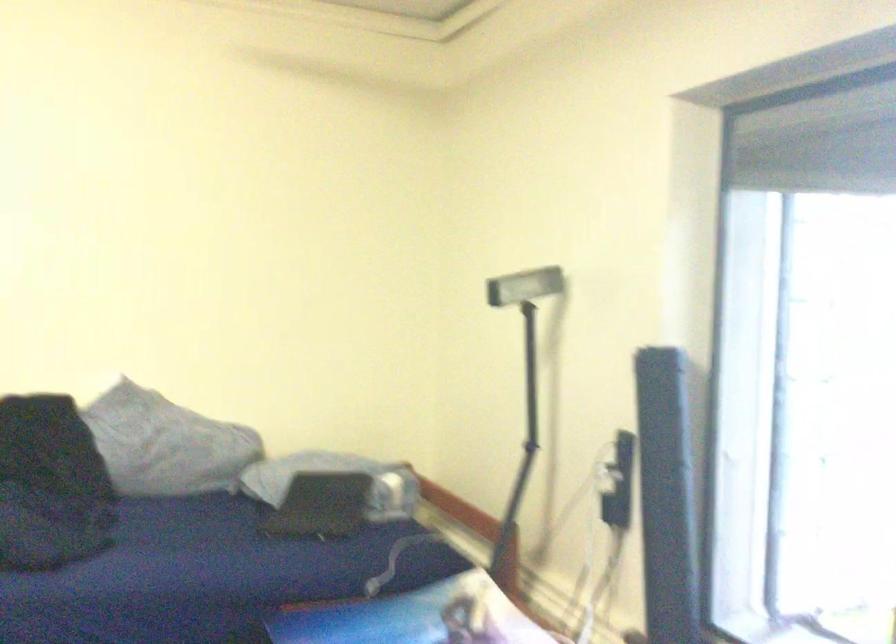
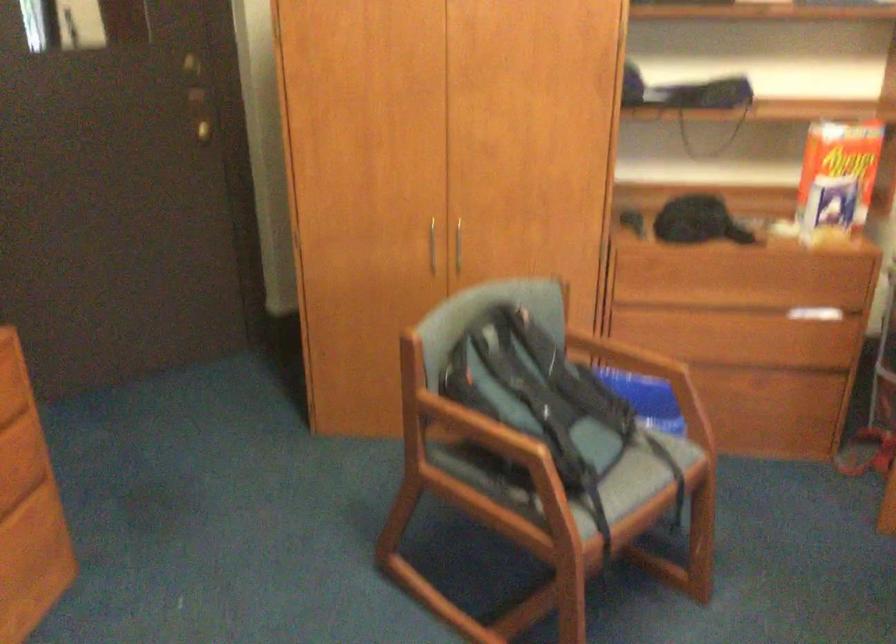
Based on the continuous images, in which direction is the camera rotating?

The camera's rotation is toward left-down.